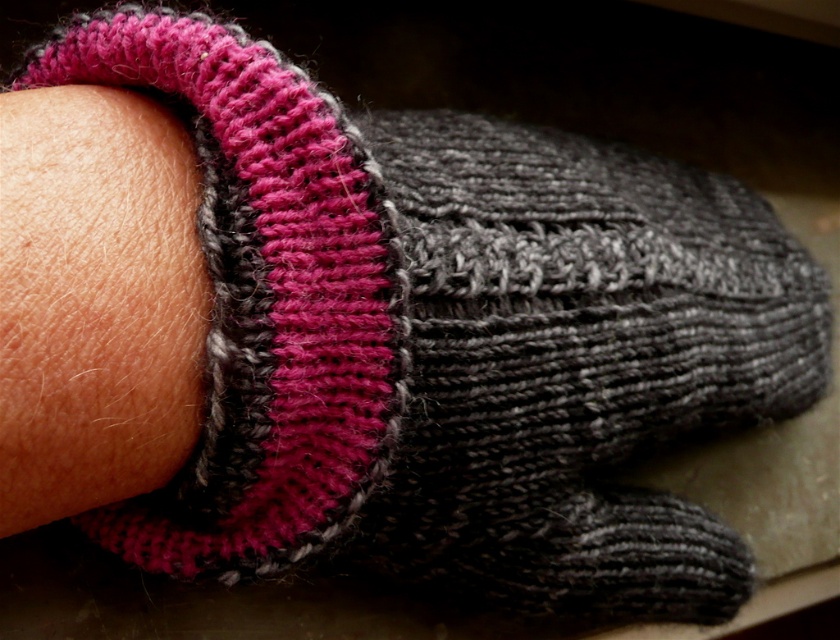
Between pink knitted wrist at lower left and fuzzy pink-gray wristband at upper left, which one is positioned higher?

pink knitted wrist at lower left is higher up.

Find the location of a particular element. pink knitted wrist at lower left is located at coordinates (95, 300).

Does point (118, 196) lie in front of point (235, 177)?

Yes, point (118, 196) is closer to viewer.

The image size is (840, 640). In order to click on pink knitted wrist at lower left in this screenshot , I will do `click(95, 300)`.